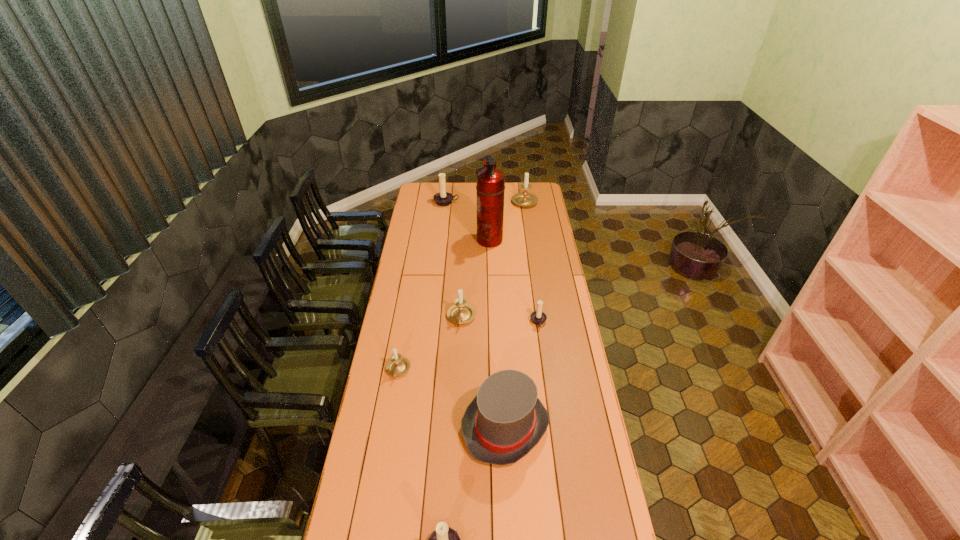
Identify the location of vacant region between the smallest brown candle holder and the smallest beige candle holder. This screenshot has width=960, height=540. (468, 346).

This screenshot has height=540, width=960. I want to click on free space between the nearest beige candle holder and the rightmost brown candle holder, so click(x=468, y=346).

You are a GUI agent. You are given a task and a screenshot of the screen. Output one action in this format:
    pyautogui.click(x=<x>, y=<y>)
    Task: Click on the free space between the fire extinguisher and the smallest beige candle holder
    The height and width of the screenshot is (540, 960).
    Given the screenshot: What is the action you would take?
    pyautogui.click(x=444, y=305)

Where is `vacant space that is in between the dress hat and the leftmost beige candle holder`? Image resolution: width=960 pixels, height=540 pixels. vacant space that is in between the dress hat and the leftmost beige candle holder is located at coordinates (451, 398).

Locate which object ranks third in proximity to the tallest object. Please provide its 2D coordinates. Your answer should be formatted as a tuple, i.e. [(x, y)], where the tuple contains the x and y coordinates of a point satisfying the conditions above.

[(461, 312)]

Locate an element on the screen. This screenshot has height=540, width=960. object that ranks as the sixth closest to the tallest object is located at coordinates (505, 421).

What are the coordinates of `candle holder that is the second closest to the dress hat` in the screenshot? It's located at (397, 365).

Select which candle holder is the fourth closest to the nearest brown candle holder. Please provide its 2D coordinates. Your answer should be formatted as a tuple, i.e. [(x, y)], where the tuple contains the x and y coordinates of a point satisfying the conditions above.

[(524, 198)]

Find the location of a particular element. The width and height of the screenshot is (960, 540). the second closest beige candle holder to the farthest beige candle holder is located at coordinates (397, 365).

Locate an element on the screen. The width and height of the screenshot is (960, 540). beige candle holder that is the closest to the nearest brown candle holder is located at coordinates (397, 365).